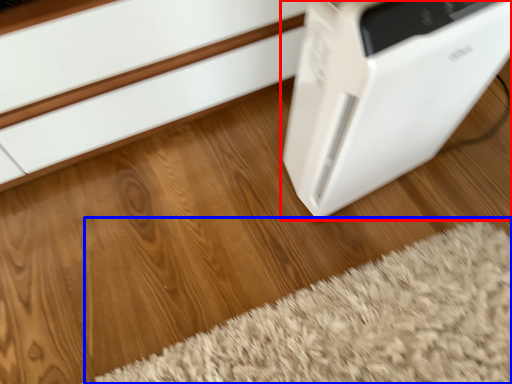
Question: Among these objects, which one is nearest to the camera, home appliance (highlighted by a red box) or doormat (highlighted by a blue box)?

Choices:
 (A) home appliance
 (B) doormat

Answer: (A)